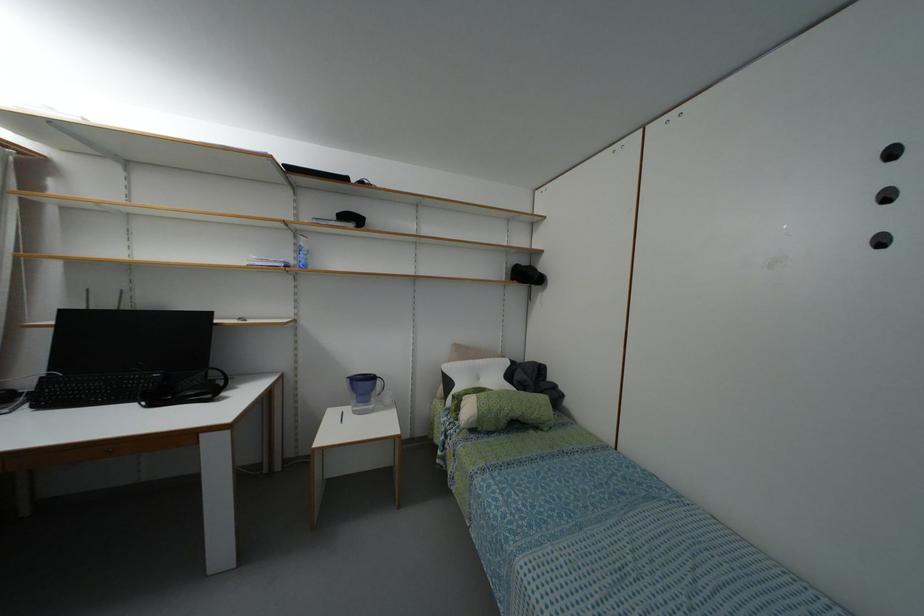
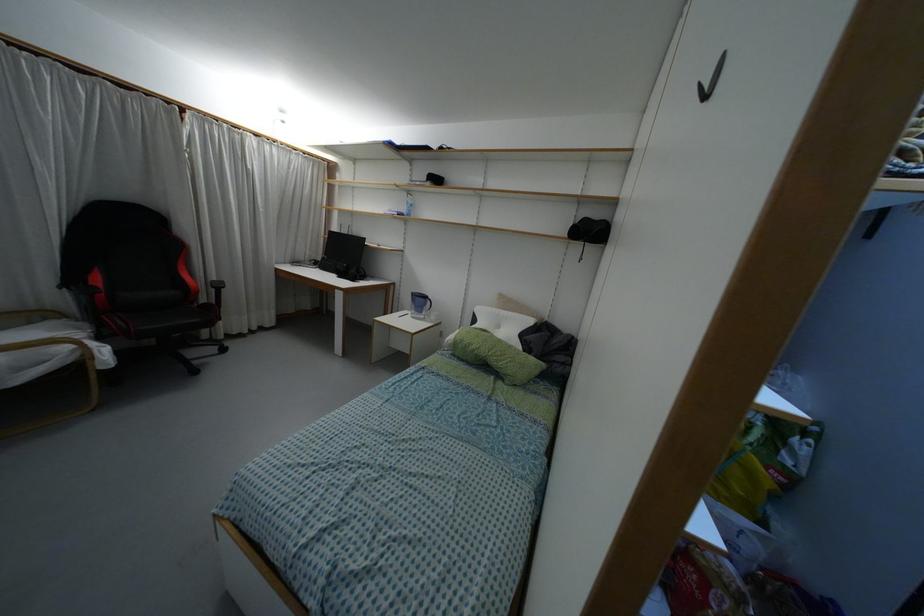
In the second image, find the point that corresponds to (x=478, y=410) in the first image.

(455, 337)